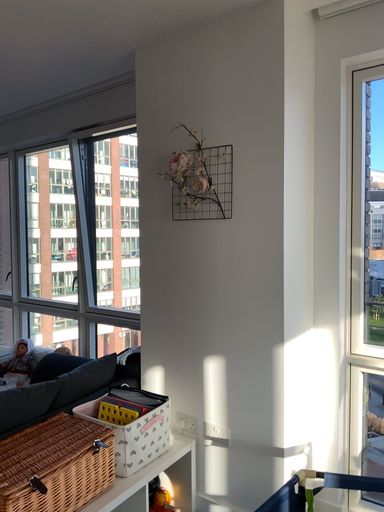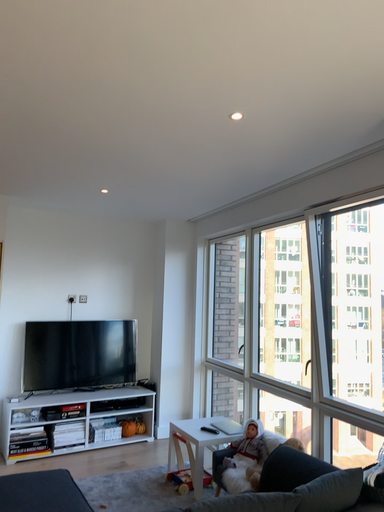
Question: Which way did the camera rotate in the video?

Choices:
 (A) rotated left
 (B) rotated right

Answer: (A)